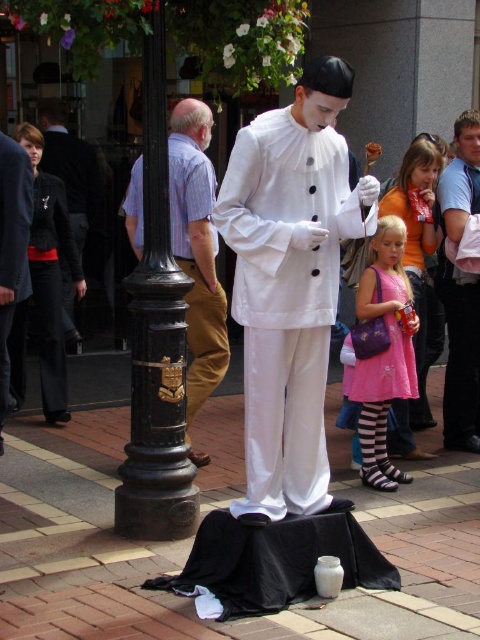
In the scene shown: You are a photographer standing in front of the scene. You want to take a photo that includes both the black matte cloth at lower center and the pink satin dress at center. Which object should you focus on first to ensure both are in focus?

The black matte cloth at lower center is closer to the viewer than the pink satin dress at center. To ensure both are in focus, focus on the black matte cloth at lower center first, as it is the closer object.

You are a photographer wanting to capture both the pink satin dress at lower right and the pink satin dress at center in a single photo. Which dress should you position closer to the camera to ensure both are in frame?

The pink satin dress at lower right is positioned on the left side of pink satin dress at center. To ensure both are in frame, position the pink satin dress at lower right closer to the camera so that it can be seen alongside the pink satin dress at center without overlapping.